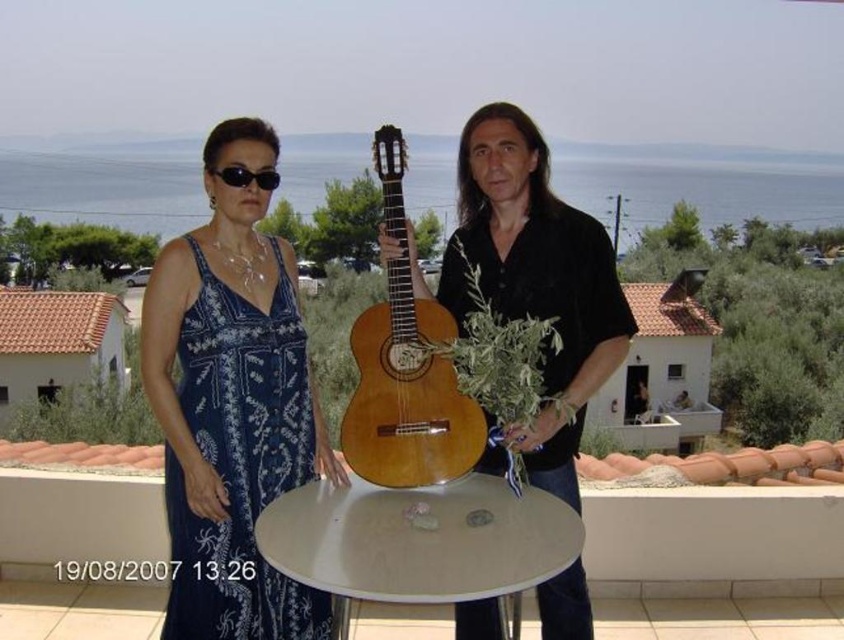
Question: Can you confirm if natural wood guitar at center is positioned above black plastic sunglasses at upper center?

Choices:
 (A) no
 (B) yes

Answer: (A)

Question: Which of the following is the closest to the observer?

Choices:
 (A) white glossy round table at center
 (B) natural wood guitar at center

Answer: (A)

Question: Does blue printed fabric dress at left have a smaller size compared to white glossy round table at center?

Choices:
 (A) yes
 (B) no

Answer: (B)

Question: Does white glossy round table at center have a lesser width compared to black plastic sunglasses at upper center?

Choices:
 (A) no
 (B) yes

Answer: (A)

Question: Which point is closer to the camera?

Choices:
 (A) (390, 214)
 (B) (176, 616)

Answer: (A)

Question: Which object is closer to the camera taking this photo?

Choices:
 (A) black plastic sunglasses at upper center
 (B) wooden guitar at center
 (C) natural wood guitar at center
 (D) blue printed fabric dress at left

Answer: (C)